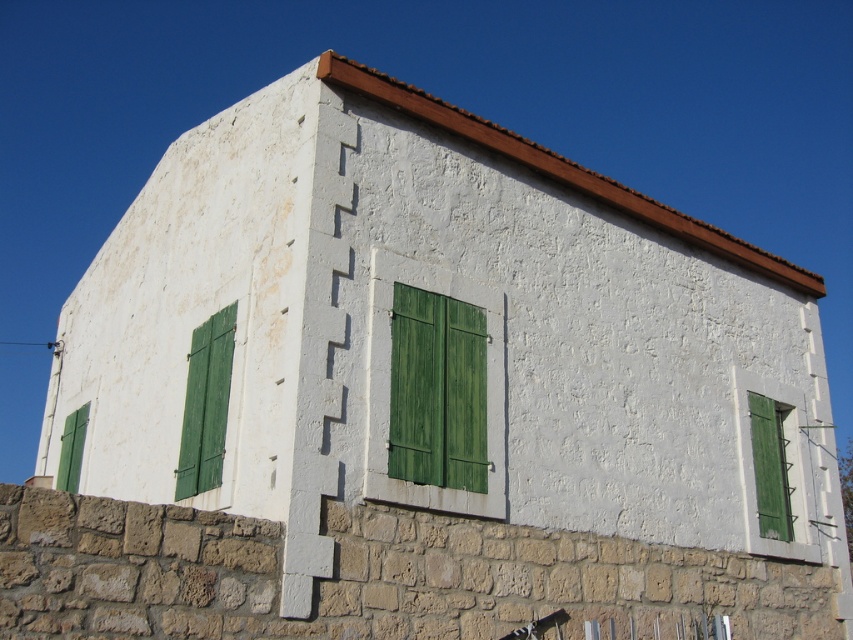
Question: Based on their relative distances, which object is nearer to the green painted wood at center?

Choices:
 (A) green matte shutter at lower left
 (B) green matte shutters at left
 (C) green matte window at right

Answer: (B)

Question: Which of the following is the farthest from the observer?

Choices:
 (A) green matte shutters at left
 (B) green matte shutter at lower left
 (C) green painted wood at center

Answer: (B)

Question: Which of the following is the farthest from the observer?

Choices:
 (A) green matte window at right
 (B) green matte shutters at left
 (C) green painted wood at center
 (D) green matte shutter at lower left

Answer: (D)

Question: Can you confirm if green matte shutters at left is positioned to the left of green matte shutter at lower left?

Choices:
 (A) no
 (B) yes

Answer: (A)

Question: Is green painted wood at center positioned in front of green matte shutters at left?

Choices:
 (A) no
 (B) yes

Answer: (B)

Question: Is green matte window at right closer to camera compared to green matte shutter at lower left?

Choices:
 (A) yes
 (B) no

Answer: (A)